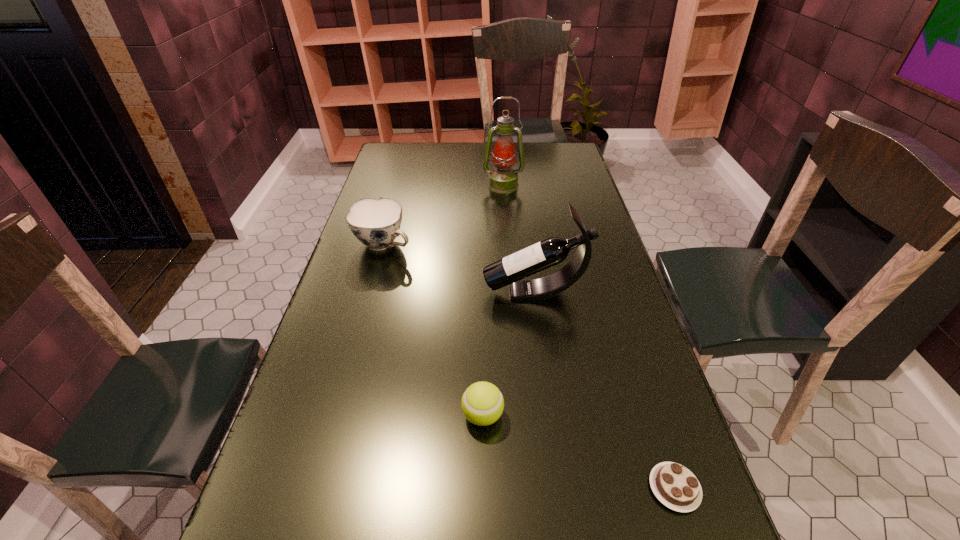
In the image, there is a desktop. What are the coordinates of `blank space at the far edge` in the screenshot? It's located at coord(530,149).

At what (x,y) coordinates should I click in order to perform the action: click on blank space at the left edge of the desktop. Please return your answer as a coordinate pair (x, y). Looking at the image, I should click on click(262, 474).

In the image, there is a desktop. At what (x,y) coordinates should I click in order to perform the action: click on free region at the right edge. Please return your answer as a coordinate pair (x, y). Looking at the image, I should click on (617, 358).

The width and height of the screenshot is (960, 540). In order to click on blank space at the far right corner of the desktop in this screenshot , I will do `click(538, 144)`.

Find the location of a particular element. vacant area between the leftmost object and the second shortest object is located at coordinates (433, 330).

Locate an element on the screen. free space between the second farthest object and the third farthest object is located at coordinates (459, 268).

Image resolution: width=960 pixels, height=540 pixels. Find the location of `vacant space in between the rightmost object and the third nearest object`. vacant space in between the rightmost object and the third nearest object is located at coordinates (605, 390).

Image resolution: width=960 pixels, height=540 pixels. I want to click on unoccupied position between the tennis ball and the second farthest object, so click(433, 330).

What are the coordinates of `vacant region between the tallest object and the tennis ball` in the screenshot? It's located at (492, 300).

Find the location of a particular element. The width and height of the screenshot is (960, 540). free point between the tennis ball and the chocolate cake is located at coordinates (579, 452).